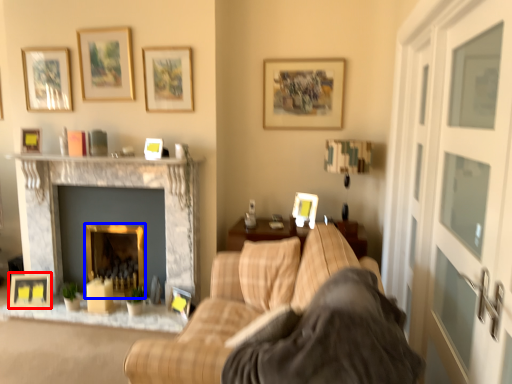
Question: Which object is further to the camera taking this photo, picture frame (highlighted by a red box) or fireplace (highlighted by a blue box)?

Choices:
 (A) picture frame
 (B) fireplace

Answer: (B)